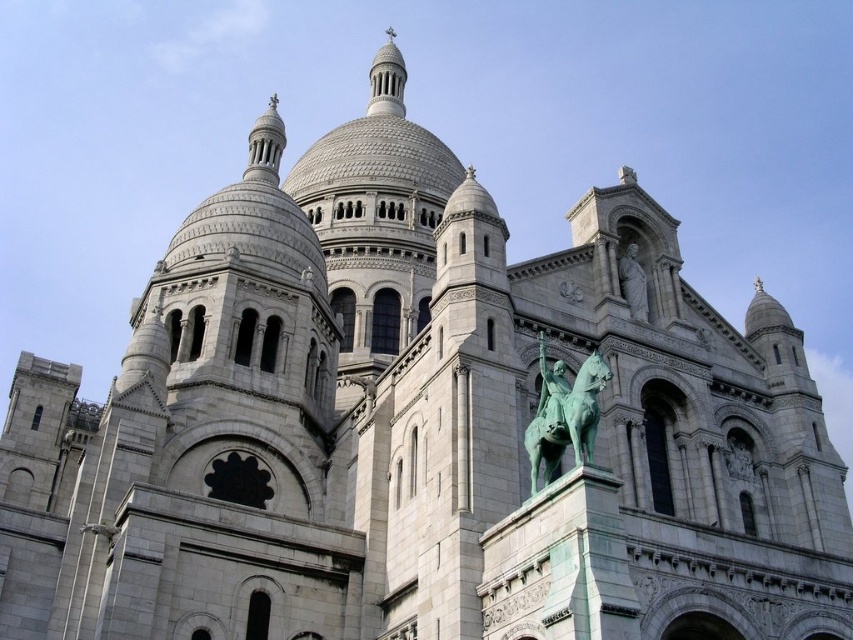
Question: Is green polished bronze statue at center further to camera compared to green patina statue at upper right?

Choices:
 (A) no
 (B) yes

Answer: (A)

Question: From the image, what is the correct spatial relationship of green polished bronze statue at center in relation to green patina statue at upper right?

Choices:
 (A) right
 (B) left

Answer: (B)

Question: Which object appears closest to the camera in this image?

Choices:
 (A) green polished bronze statue at center
 (B) green patina statue at upper right

Answer: (A)

Question: Among these objects, which one is nearest to the camera?

Choices:
 (A) green patina statue at upper right
 (B) green polished bronze statue at center

Answer: (B)

Question: Which of the following is the closest to the observer?

Choices:
 (A) green polished bronze statue at center
 (B) green patina statue at upper right

Answer: (A)

Question: Is green polished bronze statue at center to the left of green patina statue at upper right from the viewer's perspective?

Choices:
 (A) no
 (B) yes

Answer: (B)